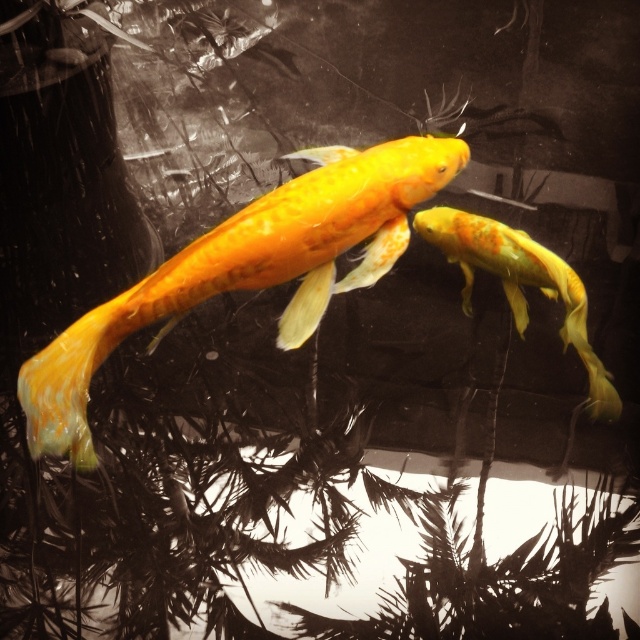
Is shiny yellow fish at center shorter than shiny orange goldfish at center?

Incorrect, shiny yellow fish at center's height does not fall short of shiny orange goldfish at center's.

Looking at this image, can you confirm if shiny yellow fish at center is bigger than shiny orange goldfish at center?

Yes, shiny yellow fish at center is bigger than shiny orange goldfish at center.

The image size is (640, 640). I want to click on shiny yellow fish at center, so click(248, 269).

Where is `shiny yellow fish at center`? shiny yellow fish at center is located at coordinates (248, 269).